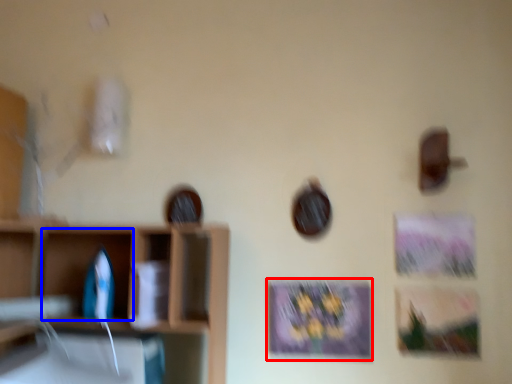
Question: Which of the following is the farthest to the observer, picture frame (highlighted by a red box) or cabinet (highlighted by a blue box)?

Choices:
 (A) picture frame
 (B) cabinet

Answer: (A)